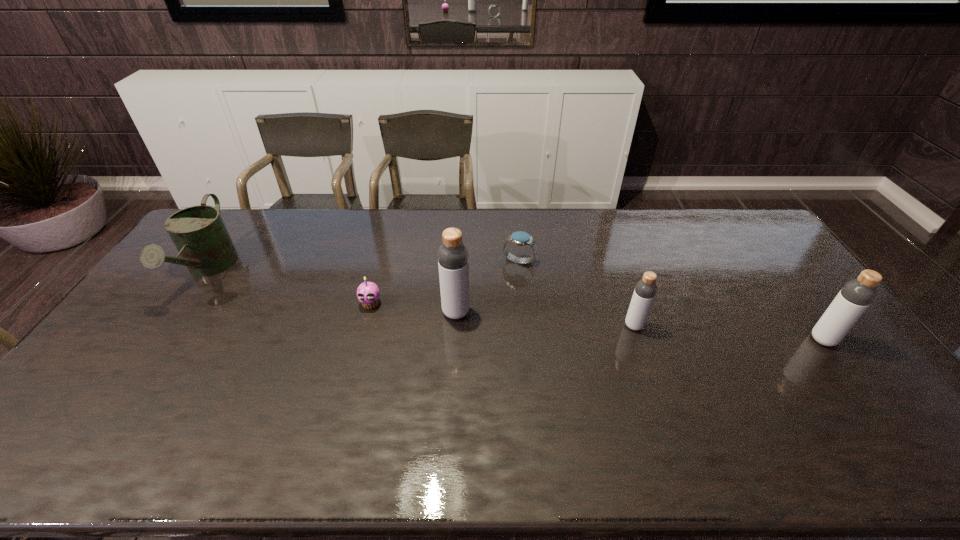
The height and width of the screenshot is (540, 960). Find the location of `free spot that satisfies the following two spatial constraints: 1. on the face of the fifth object from right to left; 2. on the right side of the second object from right to left`. free spot that satisfies the following two spatial constraints: 1. on the face of the fifth object from right to left; 2. on the right side of the second object from right to left is located at coordinates (365, 326).

Find the location of a particular element. This screenshot has height=540, width=960. free region that satisfies the following two spatial constraints: 1. with the spout on the watering can; 2. on the right side of the leftmost bottle is located at coordinates (179, 312).

The height and width of the screenshot is (540, 960). Identify the location of vacant space that satisfies the following two spatial constraints: 1. on the face of the fifth object from right to left; 2. on the left side of the second bottle from left to right. (365, 326).

Where is `vacant space that satisfies the following two spatial constraints: 1. on the front side of the fourth object from left to right; 2. on the right side of the shortest bottle`? This screenshot has height=540, width=960. vacant space that satisfies the following two spatial constraints: 1. on the front side of the fourth object from left to right; 2. on the right side of the shortest bottle is located at coordinates (x=525, y=326).

Where is `vacant point that satisfies the following two spatial constraints: 1. on the back side of the tallest bottle; 2. on the right side of the watch`? This screenshot has height=540, width=960. vacant point that satisfies the following two spatial constraints: 1. on the back side of the tallest bottle; 2. on the right side of the watch is located at coordinates (459, 261).